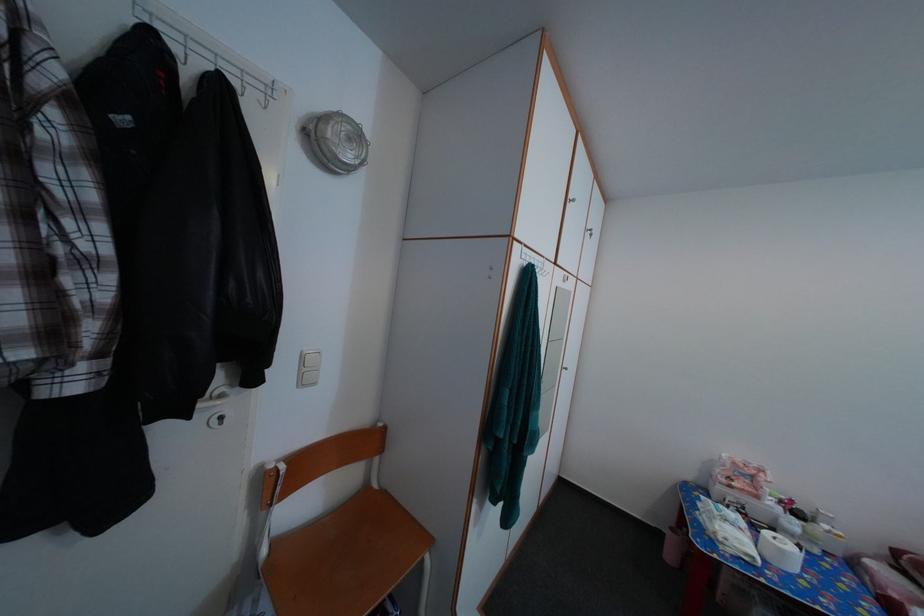
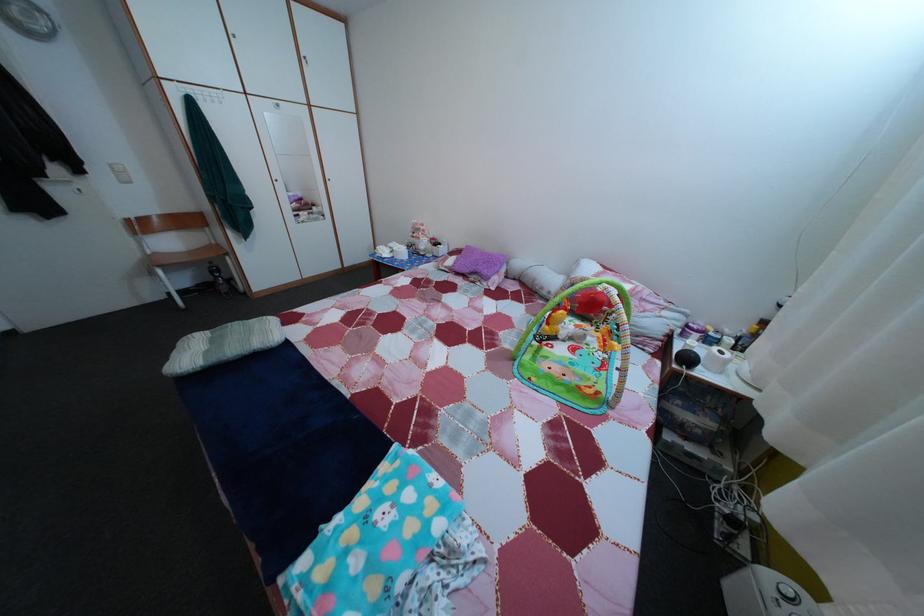
Find the pixel in the second image that matches the point at 282,552 in the first image.

(164, 261)